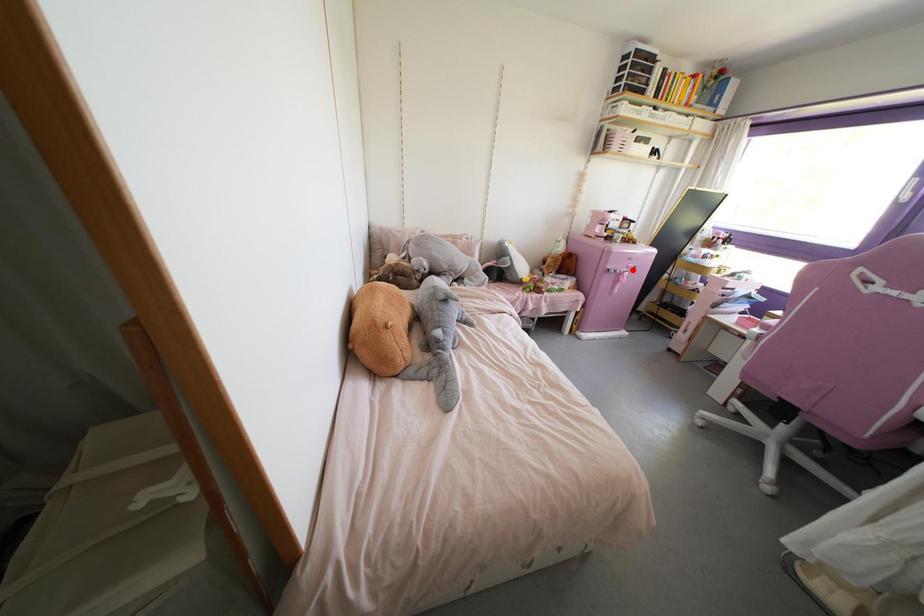
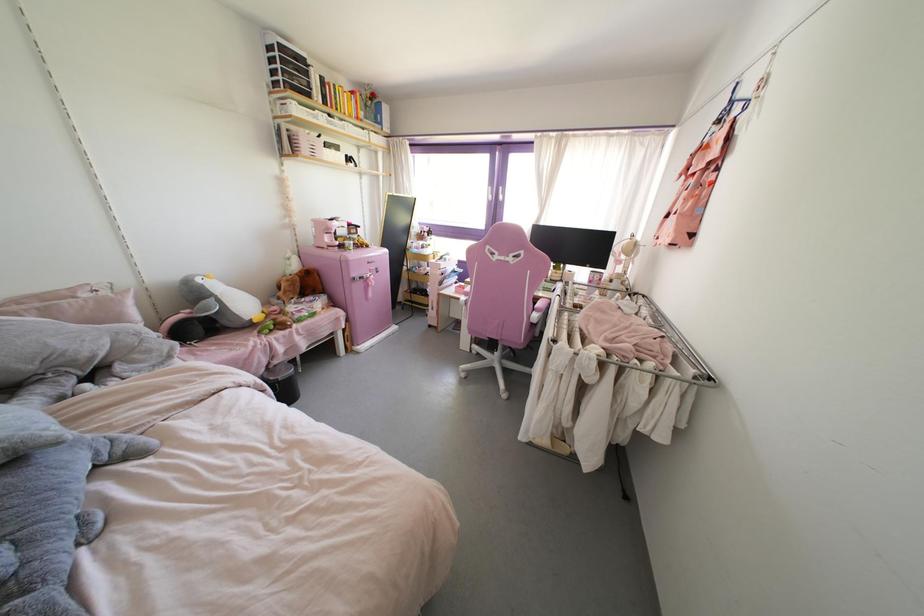
Question: I am providing you with two images of the same scene from different viewpoints. Image1 has a red point marked. In image2, the corresponding 3D location appears at what relative position? Reply with the corresponding letter.

Choices:
 (A) Closer
 (B) Farther

Answer: (A)